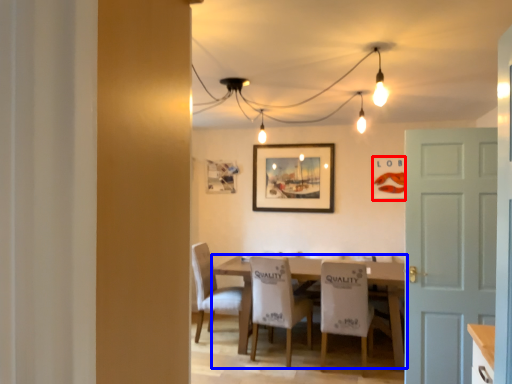
Question: Which object is closer to the camera taking this photo, picture frame (highlighted by a red box) or table (highlighted by a blue box)?

Choices:
 (A) picture frame
 (B) table

Answer: (B)